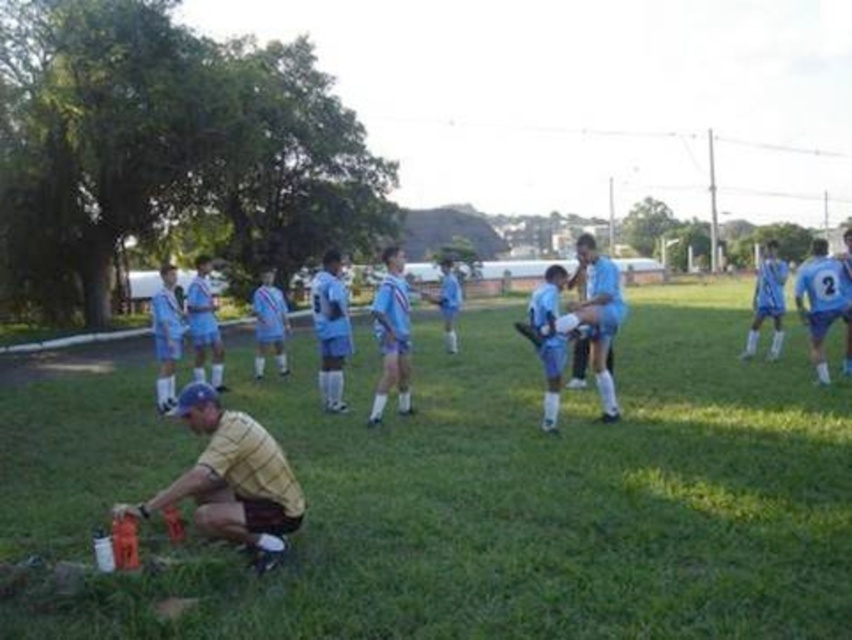
You are a photographer taking a photo of the soccer team. You notice the light blue fabric uniform at center and the light blue fabric shorts at center. Which one appears taller in the photo?

The light blue fabric uniform at center appears much taller than the light blue fabric shorts at center in the photo.

You are a photographer positioned at the center of the field. You need to capture a photo of the light blue fabric uniform at center without including the man in the yellow shirt and maroon shorts who is crouched in the foreground. Is this possible based on their positions?

The light blue fabric uniform at center is located at point (588, 316). Since the photographer is at the center of the field, adjusting the camera angle slightly to focus on the uniform while avoiding the foreground figure should be feasible as they are positioned at different coordinates.

You are a photographer trying to capture a photo of the light blue fabric uniform at center and the light blue fabric shorts at center. Which one should you focus on first if you want to capture them both in the same frame without moving the camera?

The light blue fabric uniform at center is positioned on the right side of light blue fabric shorts at center, so you should focus on the light blue fabric shorts at center first to ensure both are in the frame.